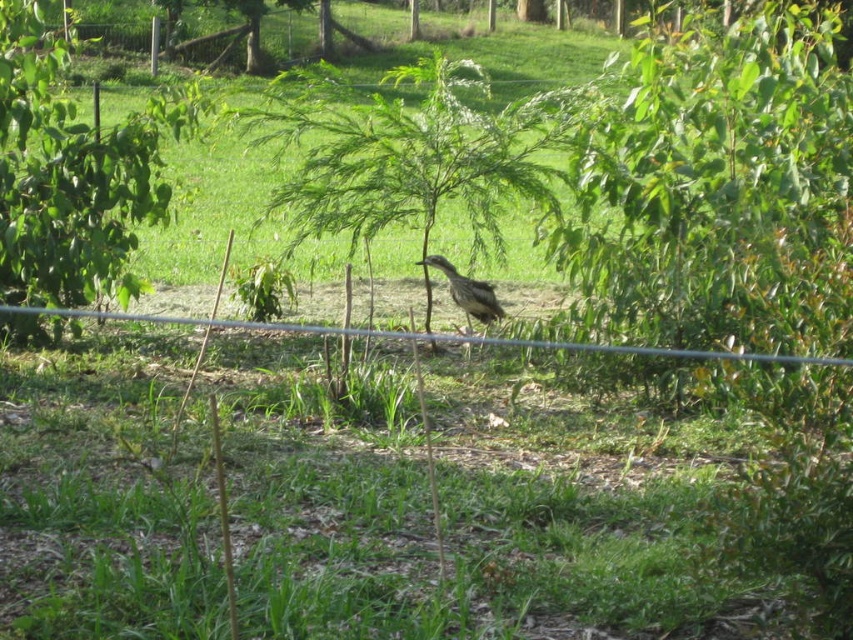
You are standing in the garden scene and want to place a small flag at both the point at (x=471, y=228) and the point at (x=4, y=86). Which point will have the flag closer to you?

The point at (x=471, y=228) is closer to you than the point at (x=4, y=86), so the flag placed there will be nearer.

You are a gardener standing in the garden and want to water the brown feathered bird at center. However, you notice the green leafy tree at left is blocking your direct path. Can you reach the bird without moving the tree?

The green leafy tree at left is in front of the brown feathered bird at center, so the tree is blocking the path. Therefore, you cannot reach the bird without moving the tree.